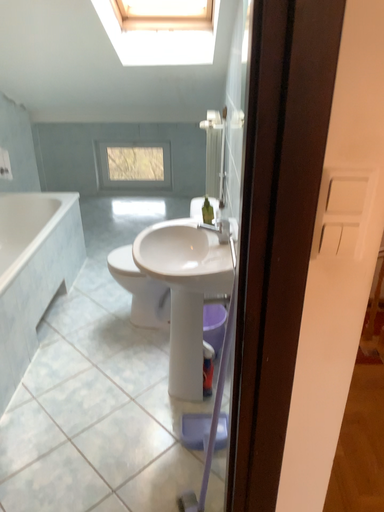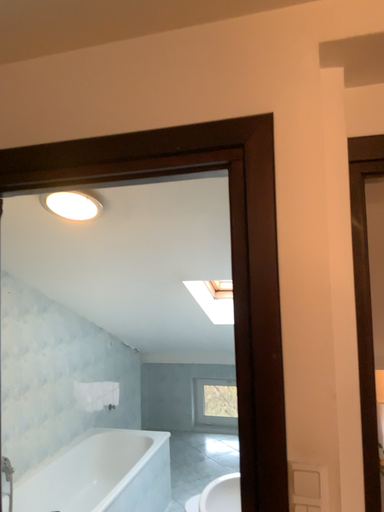
Question: How did the camera likely rotate when shooting the video?

Choices:
 (A) rotated left
 (B) rotated right

Answer: (A)